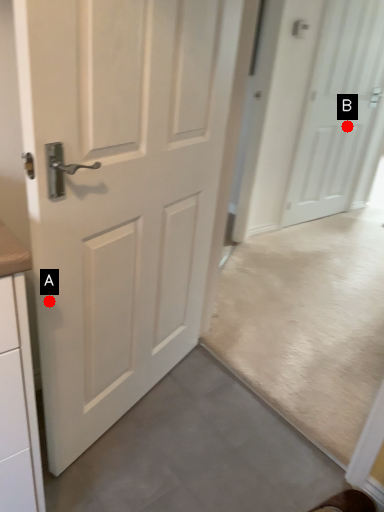
Question: Two points are circled on the image, labeled by A and B beside each circle. Which point is closer to the camera?

Choices:
 (A) A is closer
 (B) B is closer

Answer: (A)